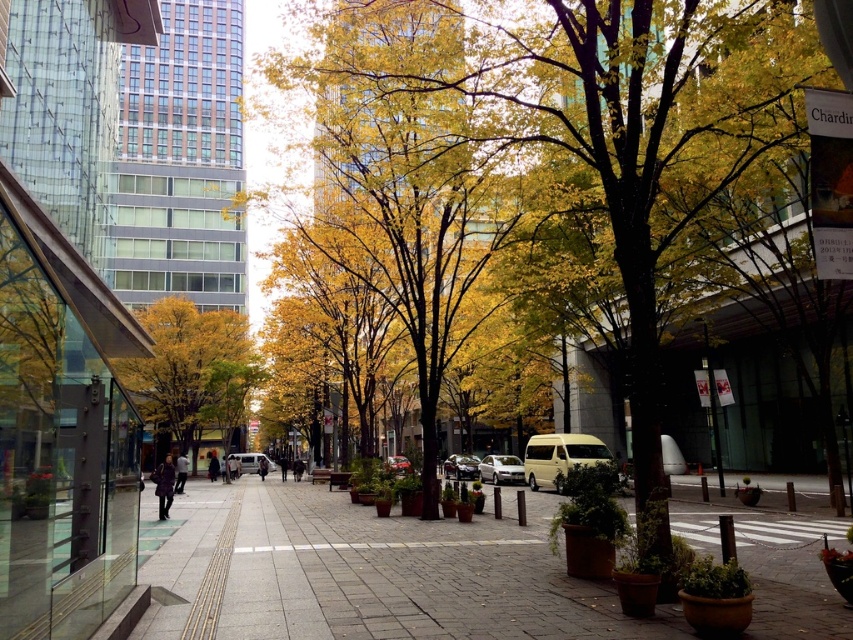
You are a delivery person trying to park your delivery van, which is 2.5 meters wide, in the space between the shiny silver car at center and the shiny red car at center. Can you fit your van there?

The shiny silver car at center might be wider than the shiny red car at center, but without knowing the exact width of either car, it is uncertain whether the space between them is wide enough to accommodate the delivery van that is 2.5 meters wide. Further measurement or information is needed to determine if the van can fit.